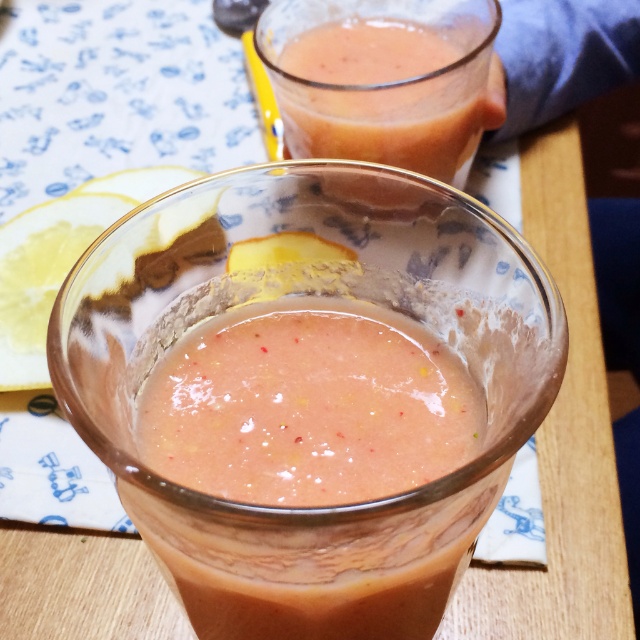
Question: Is pink frothy smoothie at center to the right of pink translucent glass at upper center from the viewer's perspective?

Choices:
 (A) yes
 (B) no

Answer: (B)

Question: In this image, where is pink frothy smoothie at center located relative to pink translucent glass at upper center?

Choices:
 (A) right
 (B) left

Answer: (B)

Question: Is pink frothy smoothie at center thinner than pink translucent glass at upper center?

Choices:
 (A) no
 (B) yes

Answer: (B)

Question: Which object is closer to the camera taking this photo?

Choices:
 (A) pink frothy smoothie at center
 (B) pink translucent glass at upper center

Answer: (A)

Question: Which point is farther from the camera taking this photo?

Choices:
 (A) (396, 589)
 (B) (284, 70)

Answer: (B)